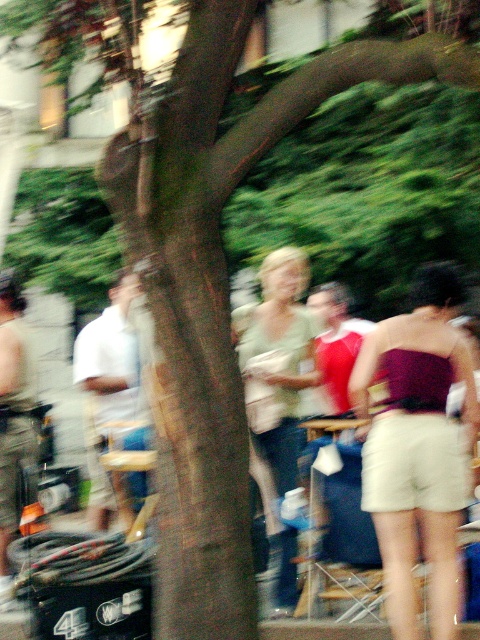
Is point (411, 602) farther from viewer compared to point (263, 376)?

No.

Is point (462, 484) positioned after point (268, 269)?

No, it is in front of (268, 269).

Find the location of `maroon satin strapless top at center`. maroon satin strapless top at center is located at coordinates (418, 448).

Between matte green shirt at center and white cotton shirt at left, which one is positioned higher?

Positioned higher is white cotton shirt at left.

Is matte green shirt at center shorter than white cotton shirt at left?

In fact, matte green shirt at center may be taller than white cotton shirt at left.

Between point (259, 342) and point (94, 470), which one is positioned in front?

Point (259, 342) is in front.

I want to click on matte green shirt at center, so click(x=278, y=362).

Is the position of maroon satin strapless top at center more distant than that of white cotton shirt at left?

No.

What do you see at coordinates (418, 448) in the screenshot? Image resolution: width=480 pixels, height=640 pixels. I see `maroon satin strapless top at center` at bounding box center [418, 448].

Between point (456, 426) and point (123, 445), which one is positioned behind?

Positioned behind is point (123, 445).

Locate an element on the screen. The width and height of the screenshot is (480, 640). maroon satin strapless top at center is located at coordinates (418, 448).